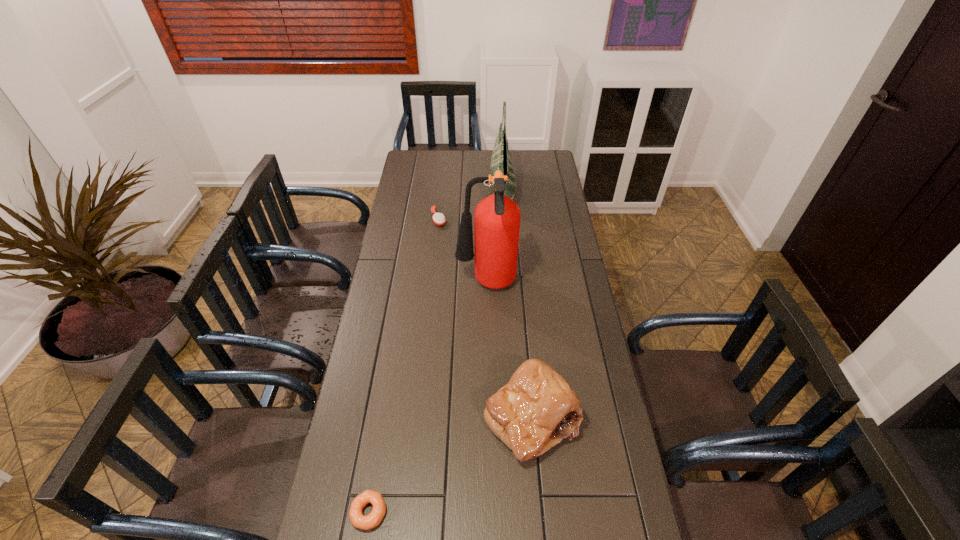
At what (x,y) coordinates should I click in order to perform the action: click on fire extinguisher. Please return your answer as a coordinate pair (x, y). The height and width of the screenshot is (540, 960). Looking at the image, I should click on (497, 218).

Identify the location of tote bag. This screenshot has width=960, height=540. (500, 160).

Where is `the second nearest object`? This screenshot has width=960, height=540. the second nearest object is located at coordinates (537, 409).

Find the location of a particular element. This screenshot has height=540, width=960. the third shortest object is located at coordinates (537, 409).

In order to click on hairbrush in this screenshot , I will do `click(438, 218)`.

Locate an element on the screen. the nearest object is located at coordinates (373, 519).

Find the location of a particular element. This screenshot has width=960, height=540. doughnut is located at coordinates (373, 519).

The width and height of the screenshot is (960, 540). In order to click on free space located 0.220m at the nozzle of the fire extinguisher in this screenshot , I will do `click(398, 285)`.

The height and width of the screenshot is (540, 960). What are the coordinates of `vacant space located 0.160m at the nozzle of the fire extinguisher` in the screenshot? It's located at (414, 285).

Find the location of a particular element. The height and width of the screenshot is (540, 960). free space located at the nozzle of the fire extinguisher is located at coordinates (409, 285).